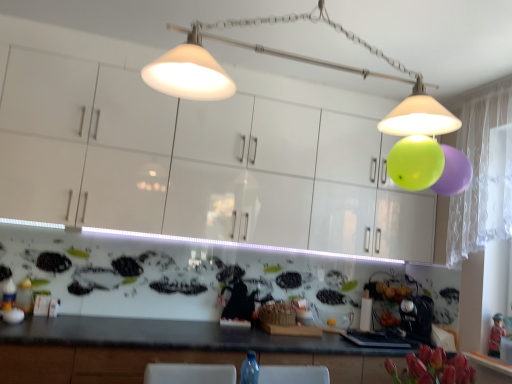
Question: From the image's perspective, is white glossy cabinets at upper center beneath wooden figurine at lower right?

Choices:
 (A) no
 (B) yes

Answer: (A)

Question: Considering the relative sizes of white glossy cabinets at upper center and wooden figurine at lower right in the image provided, is white glossy cabinets at upper center shorter than wooden figurine at lower right?

Choices:
 (A) no
 (B) yes

Answer: (A)

Question: Is white glossy cabinets at upper center thinner than wooden figurine at lower right?

Choices:
 (A) yes
 (B) no

Answer: (B)

Question: From the image's perspective, is white glossy cabinets at upper center on wooden figurine at lower right?

Choices:
 (A) no
 (B) yes

Answer: (B)

Question: Considering the relative positions of white glossy cabinets at upper center and wooden figurine at lower right in the image provided, is white glossy cabinets at upper center behind wooden figurine at lower right?

Choices:
 (A) yes
 (B) no

Answer: (B)

Question: Is white glossy cabinets at upper center positioned before wooden figurine at lower right?

Choices:
 (A) no
 (B) yes

Answer: (B)

Question: From the image's perspective, does matte white lampshade at upper center appear lower than white glossy cabinets at upper center?

Choices:
 (A) no
 (B) yes

Answer: (A)

Question: Is the depth of matte white lampshade at upper center greater than that of white glossy cabinets at upper center?

Choices:
 (A) no
 (B) yes

Answer: (A)

Question: Can you confirm if matte white lampshade at upper center is wider than white glossy cabinets at upper center?

Choices:
 (A) yes
 (B) no

Answer: (A)

Question: From a real-world perspective, is matte white lampshade at upper center under white glossy cabinets at upper center?

Choices:
 (A) no
 (B) yes

Answer: (A)

Question: Considering the relative sizes of matte white lampshade at upper center and white glossy cabinets at upper center in the image provided, is matte white lampshade at upper center bigger than white glossy cabinets at upper center?

Choices:
 (A) no
 (B) yes

Answer: (A)

Question: Is matte white lampshade at upper center not within white glossy cabinets at upper center?

Choices:
 (A) no
 (B) yes

Answer: (B)

Question: Is matte white lampshade at upper center positioned before wooden figurine at lower right?

Choices:
 (A) no
 (B) yes

Answer: (B)